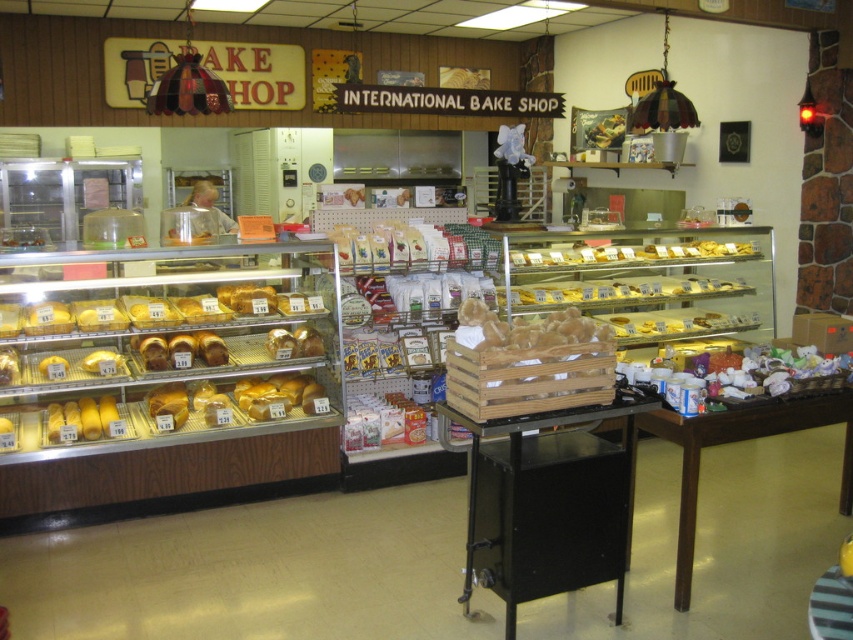
You are a customer in the International Bake Shop and want to choose a table to sit at. You prefer a smaller table for a quick snack. Which table should you choose between the black metal table at center and the brown wooden table at lower right?

The black metal table at center has a smaller size compared to brown wooden table at lower right, so you should choose the black metal table at center for a quick snack.

You are a customer entering the bakery and want to sit at both the black metal table at center and the brown wooden table at lower right. Which table should you approach first to reach both tables efficiently?

You should approach the black metal table at center first because it is positioned on the left side of the brown wooden table at lower right, so reaching it first allows you to then move to the brown wooden table at lower right without backtracking.